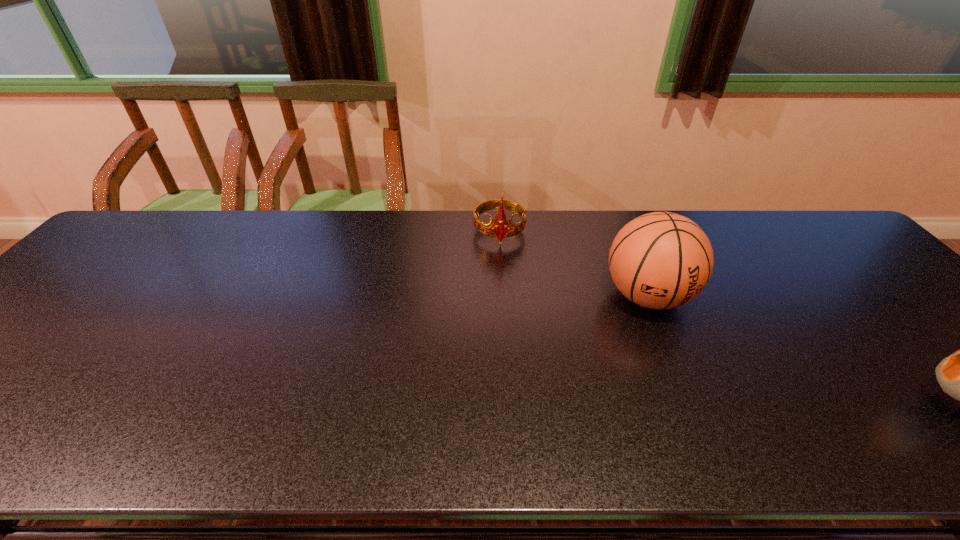
You are a GUI agent. You are given a task and a screenshot of the screen. Output one action in this format:
    pyautogui.click(x=<x>, y=<y>)
    Task: Click on the second farthest object
    
    Given the screenshot: What is the action you would take?
    pyautogui.click(x=661, y=260)

Find the location of a particular element. This screenshot has height=540, width=960. the second object from left to right is located at coordinates (661, 260).

Where is `tiara`? The image size is (960, 540). tiara is located at coordinates (501, 228).

You are a GUI agent. You are given a task and a screenshot of the screen. Output one action in this format:
    pyautogui.click(x=<x>, y=<y>)
    Task: Click on the farthest object
    
    Given the screenshot: What is the action you would take?
    pyautogui.click(x=501, y=228)

Locate an element on the screen. Image resolution: width=960 pixels, height=540 pixels. free region located 0.140m on the surface of the basketball near the brand logo is located at coordinates (682, 377).

Locate an element on the screen. vacant area situated on the front-facing side of the leftmost object is located at coordinates (504, 305).

Identify the location of object at the far edge. The height and width of the screenshot is (540, 960). (501, 228).

In the image, there is a desktop. Where is `vacant space at the far edge`? The image size is (960, 540). vacant space at the far edge is located at coordinates (550, 238).

Identify the location of free space at the near edge. (306, 444).

What are the coordinates of `free space at the right edge of the desktop` in the screenshot? It's located at (889, 312).